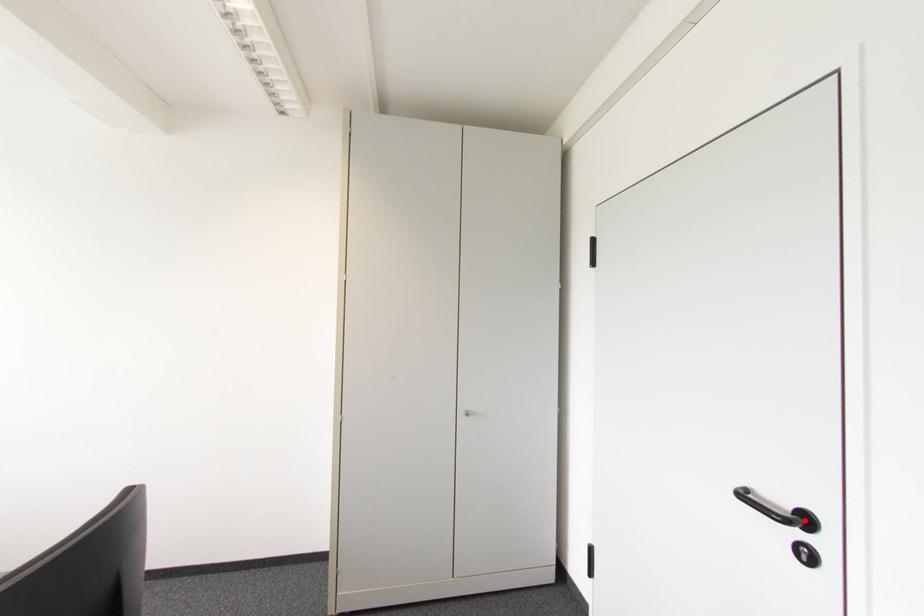
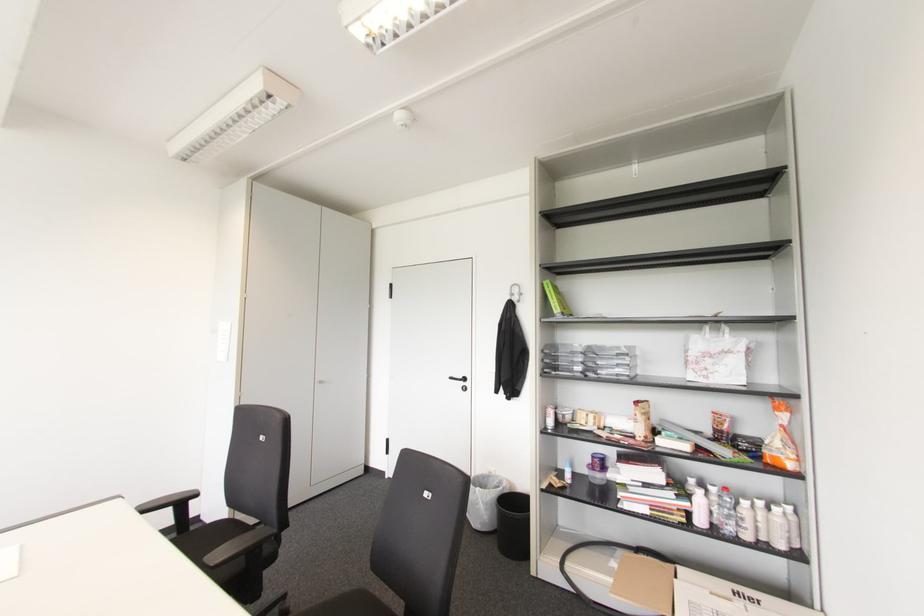
Find the pixel in the second image that matches the highlighted location in the first image.

(464, 379)